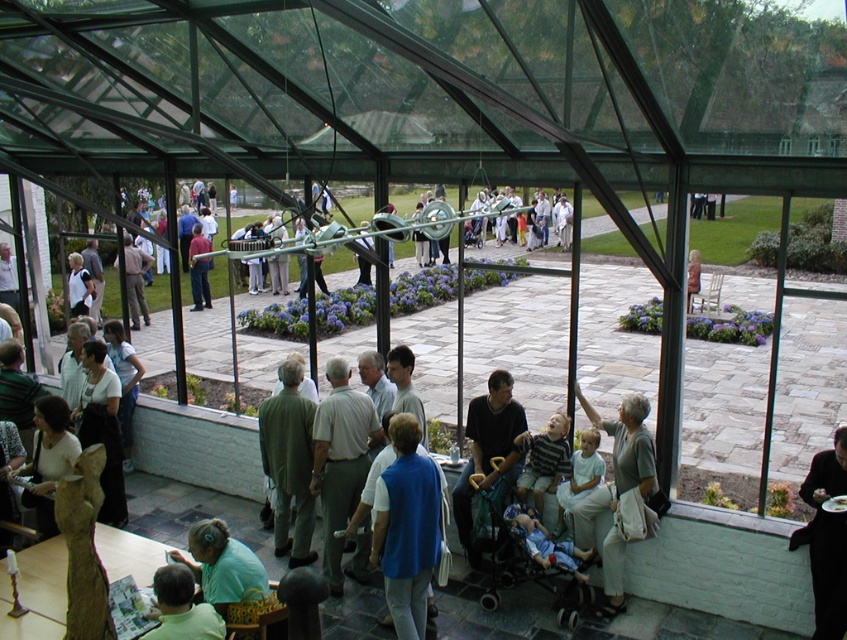
This screenshot has height=640, width=847. Find the location of `blue fabric vest at center`. blue fabric vest at center is located at coordinates (407, 528).

Find the location of `blue fabric vest at center`. blue fabric vest at center is located at coordinates (407, 528).

Locate an element on the screen. This screenshot has height=640, width=847. light gray shirt at center is located at coordinates (340, 460).

Is blue fabric vest at center below light gray shirt at center?

Indeed, blue fabric vest at center is positioned under light gray shirt at center.

Which is below, blue fabric vest at center or light gray shirt at center?

blue fabric vest at center is lower down.

Find the location of a particular element. blue fabric vest at center is located at coordinates (407, 528).